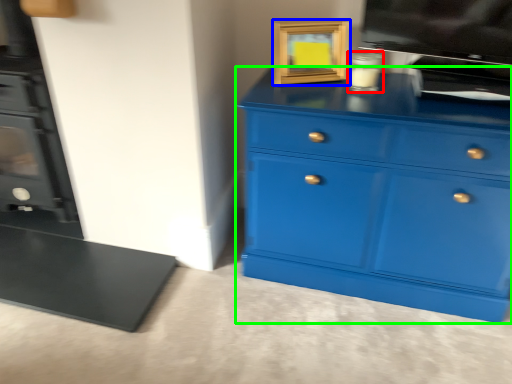
Question: Considering the real-world distances, which object is closest to appliance (highlighted by a red box)? picture frame (highlighted by a blue box) or chest of drawers (highlighted by a green box).

Choices:
 (A) picture frame
 (B) chest of drawers

Answer: (A)